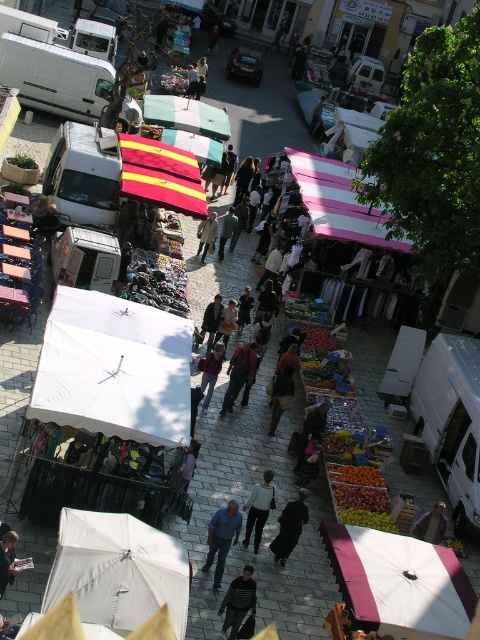
You are a customer at the market and want to buy both the white matte umbrella at lower left and the denim jacket at center. You need to place them on a shelf that can only hold items up to 1 meter in width. Can you fit both items on the shelf together?

The white matte umbrella at lower left might be wider than the denim jacket at center, so it is uncertain if both items can fit on the shelf together. Check the actual width of the umbrella before deciding.

You are standing at the entrance of the market and want to find the yellow striped fabric canopy at center. According to the coordinates provided, where should you look relative to your current position?

The yellow striped fabric canopy at center is located at coordinates point (160, 176), which means it is positioned to the lower right from your current position at the entrance.

You are a customer at the market and want to buy the khaki fabric jacket at center. The yellow striped fabric canopy at center is blocking your view. Can you walk around the canopy to see the jacket better?

The yellow striped fabric canopy at center is closer to the viewer than the khaki fabric jacket at center, so you can walk around the canopy to get a better view of the jacket.